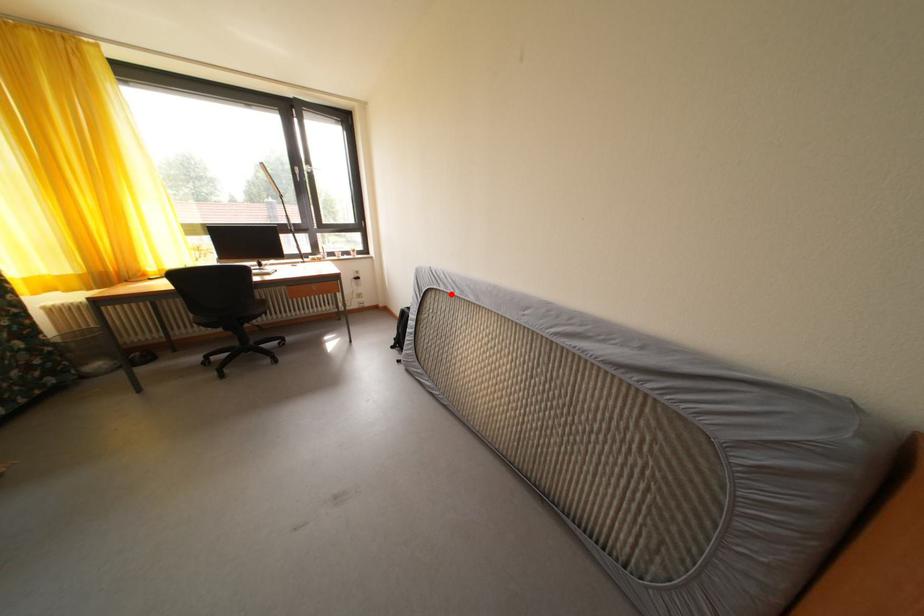
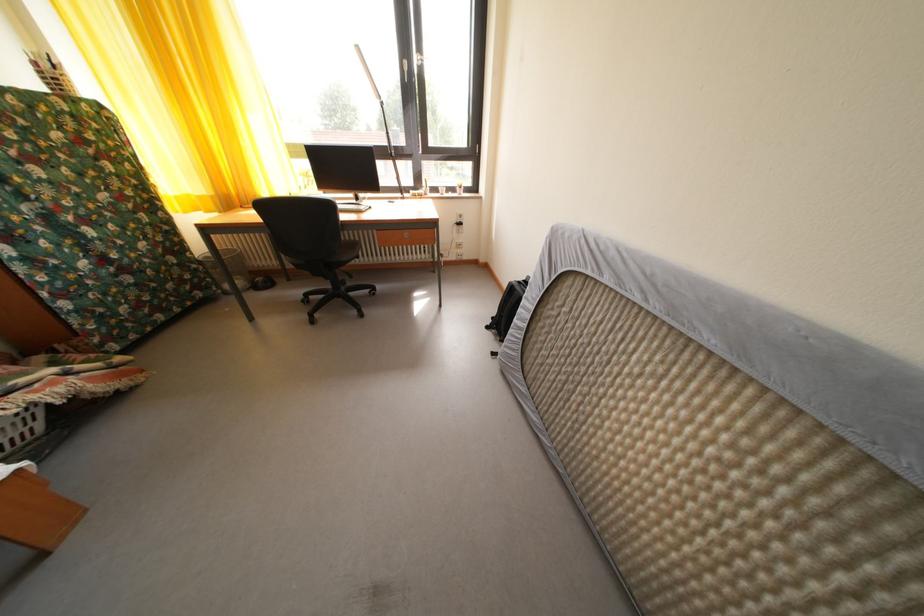
Where in the second image is the point corresponding to the highlighted location from the first image?

(615, 285)